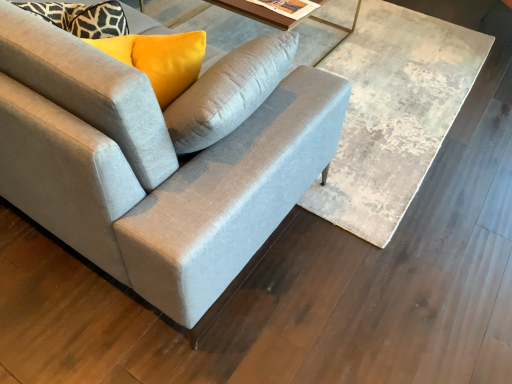
In order to click on matte glass table at upper center in this screenshot , I will do `click(206, 21)`.

In order to face matte glass table at upper center, should I rotate leftwards or rightwards?

Rotate your view left by about 0.053°.

Find the location of `suede gray couch at center`. suede gray couch at center is located at coordinates (153, 167).

What do you see at coordinates (393, 113) in the screenshot? The width and height of the screenshot is (512, 384). I see `wooden textured table at center` at bounding box center [393, 113].

At what (x,y) coordinates should I click in order to perform the action: click on matte glass table at upper center. Please return your answer as a coordinate pair (x, y). Image resolution: width=512 pixels, height=384 pixels. Looking at the image, I should click on (206, 21).

Consider the image. Considering the sizes of objects matte glass table at upper center and suede gray couch at center in the image provided, who is smaller, matte glass table at upper center or suede gray couch at center?

matte glass table at upper center is smaller.

Can you confirm if matte glass table at upper center is positioned to the left of suede gray couch at center?

Incorrect, matte glass table at upper center is not on the left side of suede gray couch at center.

Is matte glass table at upper center thinner than suede gray couch at center?

Yes.

Measure the distance between matte glass table at upper center and suede gray couch at center.

1.40 meters.

Is point (177, 244) closer or farther from the camera than point (176, 5)?

Clearly, point (177, 244) is closer to the camera than point (176, 5).

Based on the photo, is suede gray couch at center situated inside matte glass table at upper center or outside?

suede gray couch at center lies outside matte glass table at upper center.

Considering the relative positions of suede gray couch at center and matte glass table at upper center in the image provided, is suede gray couch at center to the left or to the right of matte glass table at upper center?

suede gray couch at center is positioned on matte glass table at upper center's left side.

Does point (385, 146) appear closer or farther from the camera than point (164, 307)?

Clearly, point (385, 146) is more distant from the camera than point (164, 307).

Does wooden textured table at center touch suede gray couch at center?

wooden textured table at center and suede gray couch at center are clearly separated.

From the image's perspective, between wooden textured table at center and suede gray couch at center, which one is located above?

wooden textured table at center appears higher in the image.

Between suede gray couch at center and wooden textured table at center, which one has smaller size?

With smaller size is wooden textured table at center.

Between suede gray couch at center and wooden textured table at center, which one appears on the right side from the viewer's perspective?

Positioned to the right is wooden textured table at center.

Considering the positions of points (249, 121) and (431, 46), is point (249, 121) farther from camera compared to point (431, 46)?

No, it is not.

Is suede gray couch at center not within wooden textured table at center?

Yes, suede gray couch at center is outside of wooden textured table at center.

Is matte glass table at upper center facing away from wooden textured table at center?

No, wooden textured table at center is not at the back of matte glass table at upper center.

Considering their positions, is matte glass table at upper center located in front of or behind wooden textured table at center?

matte glass table at upper center is behind wooden textured table at center.

Based on the photo, in the image, is matte glass table at upper center on the left side or the right side of wooden textured table at center?

matte glass table at upper center is positioned on wooden textured table at center's left side.

Is matte glass table at upper center in contact with wooden textured table at center?

No, matte glass table at upper center is not making contact with wooden textured table at center.

Can you see wooden textured table at center touching matte glass table at upper center?

wooden textured table at center and matte glass table at upper center are clearly separated.

Considering the relative sizes of wooden textured table at center and matte glass table at upper center in the image provided, is wooden textured table at center wider than matte glass table at upper center?

Correct, the width of wooden textured table at center exceeds that of matte glass table at upper center.

Is wooden textured table at center situated inside matte glass table at upper center or outside?

wooden textured table at center exists outside the volume of matte glass table at upper center.

Between wooden textured table at center and matte glass table at upper center, which one has more height?

matte glass table at upper center.

Find the location of a particular element. The width and height of the screenshot is (512, 384). round table that is under the suede gray couch at center (from a real-world perspective) is located at coordinates (206, 21).

You are a GUI agent. You are given a task and a screenshot of the screen. Output one action in this format:
    pyautogui.click(x=<x>, y=<y>)
    Task: Click on the round table behind the suede gray couch at center
    
    Given the screenshot: What is the action you would take?
    pyautogui.click(x=206, y=21)

When comparing their distances from matte glass table at upper center, does wooden textured table at center or suede gray couch at center seem closer?

Among the two, wooden textured table at center is located nearer to matte glass table at upper center.

When comparing their distances from suede gray couch at center, does wooden textured table at center or matte glass table at upper center seem closer?

wooden textured table at center lies closer to suede gray couch at center than the other object.

Based on their spatial positions, is matte glass table at upper center or wooden textured table at center further from suede gray couch at center?

Among the two, matte glass table at upper center is located further to suede gray couch at center.

Based on their spatial positions, is suede gray couch at center or matte glass table at upper center closer to wooden textured table at center?

Based on the image, matte glass table at upper center appears to be nearer to wooden textured table at center.

From the image, which object appears to be nearer to wooden textured table at center, matte glass table at upper center or suede gray couch at center?

matte glass table at upper center is positioned closer to the anchor wooden textured table at center.

Considering their positions, is suede gray couch at center positioned further to matte glass table at upper center than wooden textured table at center?

suede gray couch at center is further to matte glass table at upper center.

The width and height of the screenshot is (512, 384). Identify the location of table located between suede gray couch at center and matte glass table at upper center in the depth direction. (393, 113).